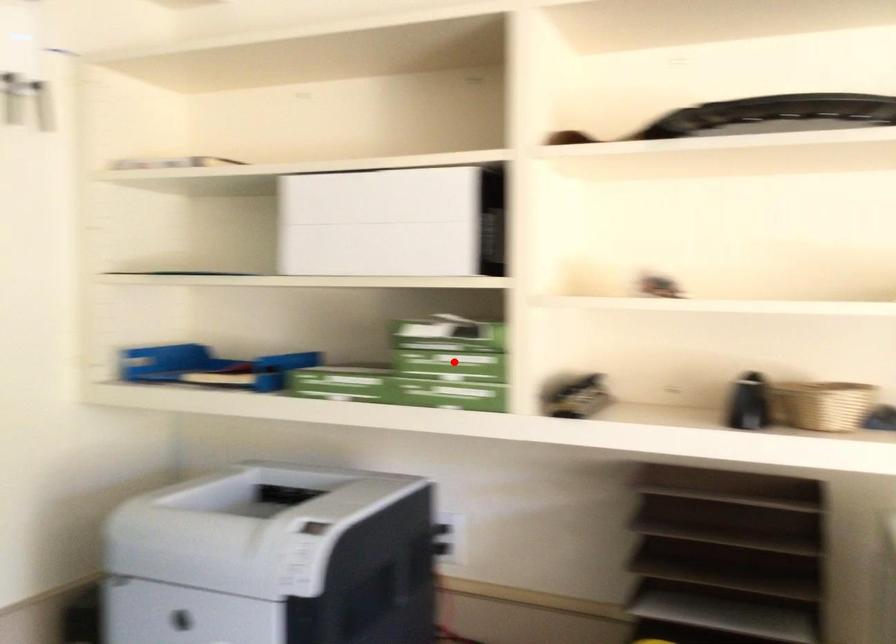
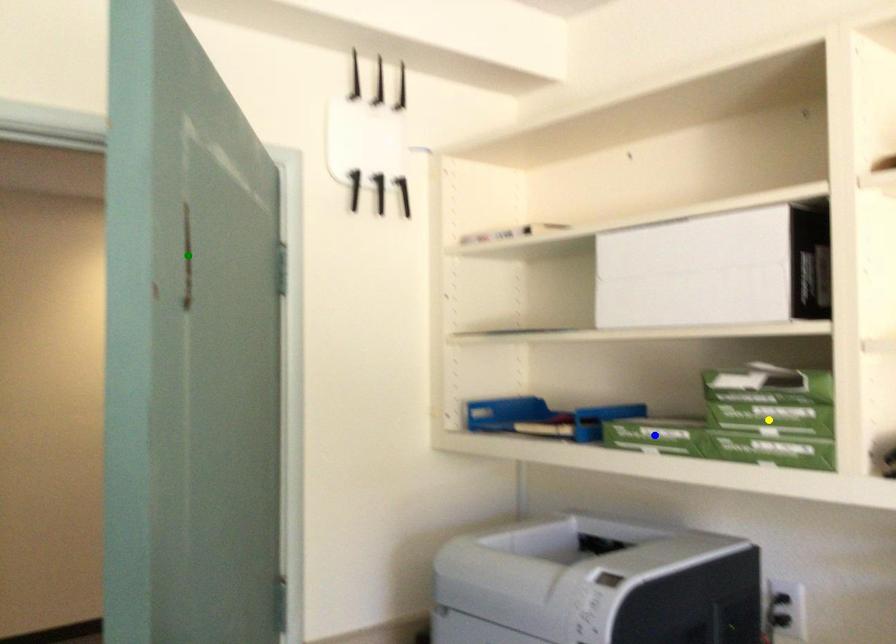
Question: I am providing you with two images of the same scene from different viewpoints. A red point is marked on the first image. You are given multiple points on the second image. In image 2, which mark is for the same physical point as the one in image 1?

Choices:
 (A) blue point
 (B) green point
 (C) yellow point

Answer: (C)